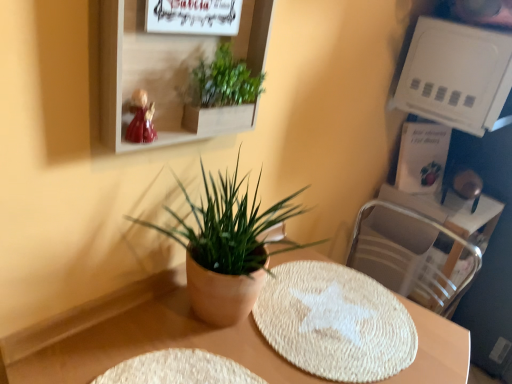
You are a GUI agent. You are given a task and a screenshot of the screen. Output one action in this format:
    pyautogui.click(x=<x>, y=<y>)
    Task: Click on the white woven mat at center
    The image size is (512, 384).
    Given the screenshot: What is the action you would take?
    pyautogui.click(x=335, y=322)

What do you see at coordinates (135, 337) in the screenshot?
I see `beige woven placemat at center` at bounding box center [135, 337].

This screenshot has height=384, width=512. What do you see at coordinates (228, 247) in the screenshot?
I see `green matte plant at center, which ranks as the first houseplant in bottom-to-top order` at bounding box center [228, 247].

Where is `white plastic shelf at upper right, which ranks as the 2th shelf in front-to-back order`? white plastic shelf at upper right, which ranks as the 2th shelf in front-to-back order is located at coordinates (456, 76).

Identify the location of white woven mat at center. The image size is (512, 384). (335, 322).

Is metallic silver swivel chair at right aimed at green matte plant at center, arranged as the 2th houseplant when viewed from the top?

Yes, metallic silver swivel chair at right is oriented towards green matte plant at center, arranged as the 2th houseplant when viewed from the top.

Is metallic silver swivel chair at right outside of green matte plant at center, arranged as the 2th houseplant when viewed from the top?

metallic silver swivel chair at right lies outside green matte plant at center, arranged as the 2th houseplant when viewed from the top,'s area.

Which object is positioned more to the left, metallic silver swivel chair at right or green matte plant at center, arranged as the 2th houseplant when viewed from the top?

From the viewer's perspective, green matte plant at center, arranged as the 2th houseplant when viewed from the top, appears more on the left side.

Considering the sizes of objects metallic silver swivel chair at right and white woven mat at center in the image provided, who is bigger, metallic silver swivel chair at right or white woven mat at center?

Bigger between the two is metallic silver swivel chair at right.

How many degrees apart are the facing directions of metallic silver swivel chair at right and white woven mat at center?

metallic silver swivel chair at right and white woven mat at center are facing 88.7 degrees away from each other.

Does point (362, 270) lie behind point (270, 306)?

Yes, point (362, 270) is farther from viewer.

From a real-world perspective, is green matte plant at center, which ranks as the first houseplant in bottom-to-top order, positioned under green leafy plant at upper center, which appears as the 2th houseplant when ordered from the bottom, based on gravity?

Yes, from a real-world perspective, green matte plant at center, which ranks as the first houseplant in bottom-to-top order, is under green leafy plant at upper center, which appears as the 2th houseplant when ordered from the bottom.

Consider the image. How many degrees apart are the facing directions of green matte plant at center, arranged as the 2th houseplant when viewed from the top, and green leafy plant at upper center, which appears as the 2th houseplant when ordered from the bottom?

The angle between the facing direction of green matte plant at center, arranged as the 2th houseplant when viewed from the top, and the facing direction of green leafy plant at upper center, which appears as the 2th houseplant when ordered from the bottom, is 2.8 degrees.

From the picture: Considering the sizes of green matte plant at center, arranged as the 2th houseplant when viewed from the top, and green leafy plant at upper center, which appears as the 2th houseplant when ordered from the bottom, in the image, is green matte plant at center, arranged as the 2th houseplant when viewed from the top, wider or thinner than green leafy plant at upper center, which appears as the 2th houseplant when ordered from the bottom,?

Clearly, green matte plant at center, arranged as the 2th houseplant when viewed from the top, has more width compared to green leafy plant at upper center, which appears as the 2th houseplant when ordered from the bottom.

Is green matte plant at center, arranged as the 2th houseplant when viewed from the top, oriented away from green leafy plant at upper center, which appears as the 1th houseplant when viewed from the top?

No, green leafy plant at upper center, which appears as the 1th houseplant when viewed from the top, is not at the back of green matte plant at center, arranged as the 2th houseplant when viewed from the top.

Is metallic silver swivel chair at right turned away from beige woven placemat at center?

No, metallic silver swivel chair at right is not facing the opposite direction of beige woven placemat at center.

Is point (429, 292) closer or farther from the camera than point (401, 375)?

Point (429, 292) is farther from the camera than point (401, 375).

Is metallic silver swivel chair at right next to beige woven placemat at center and touching it?

No, metallic silver swivel chair at right is not in contact with beige woven placemat at center.

Is metallic silver swivel chair at right taller than beige woven placemat at center?

No, metallic silver swivel chair at right is not taller than beige woven placemat at center.

Who is bigger, beige woven placemat at center or matte white shelf at upper center, which appears as the second shelf when viewed from the back?

beige woven placemat at center is bigger.

How much distance is there between beige woven placemat at center and matte white shelf at upper center, which is counted as the first shelf, starting from the front?

They are 17.12 inches apart.

How many degrees apart are the facing directions of beige woven placemat at center and matte white shelf at upper center, which is counted as the first shelf, starting from the front?

There is a 0.505-degree angle between the facing directions of beige woven placemat at center and matte white shelf at upper center, which is counted as the first shelf, starting from the front.

Is beige woven placemat at center thinner than matte white shelf at upper center, placed as the second shelf when sorted from right to left?

No, beige woven placemat at center is not thinner than matte white shelf at upper center, placed as the second shelf when sorted from right to left.

Is the position of green leafy plant at upper center, which appears as the 2th houseplant when ordered from the bottom, less distant than that of white plastic shelf at upper right, which is counted as the first shelf, starting from the back?

Yes, green leafy plant at upper center, which appears as the 2th houseplant when ordered from the bottom, is closer to the camera.

Is white plastic shelf at upper right, which ranks as the 2th shelf in front-to-back order, at the back of green leafy plant at upper center, which appears as the 1th houseplant when viewed from the top?

No, green leafy plant at upper center, which appears as the 1th houseplant when viewed from the top, is not facing the opposite direction of white plastic shelf at upper right, which ranks as the 2th shelf in front-to-back order.

Which is farther, (257, 98) or (414, 112)?

Positioned behind is point (414, 112).

From a real-world perspective, which is physically above, green leafy plant at upper center, which appears as the 1th houseplant when viewed from the top, or white plastic shelf at upper right, which ranks as the 2th shelf in front-to-back order?

white plastic shelf at upper right, which ranks as the 2th shelf in front-to-back order, from a real-world perspective.

From a real-world perspective, which is physically above, white plastic shelf at upper right, which ranks as the 1th shelf in right-to-left order, or beige woven placemat at center?

In real-world perspective, white plastic shelf at upper right, which ranks as the 1th shelf in right-to-left order, is above.

Considering the sizes of objects white plastic shelf at upper right, which is counted as the first shelf, starting from the back, and beige woven placemat at center in the image provided, who is smaller, white plastic shelf at upper right, which is counted as the first shelf, starting from the back, or beige woven placemat at center?

Smaller between the two is white plastic shelf at upper right, which is counted as the first shelf, starting from the back.

Considering the relative sizes of white plastic shelf at upper right, which ranks as the 1th shelf in right-to-left order, and beige woven placemat at center in the image provided, is white plastic shelf at upper right, which ranks as the 1th shelf in right-to-left order, shorter than beige woven placemat at center?

Yes, white plastic shelf at upper right, which ranks as the 1th shelf in right-to-left order, is shorter than beige woven placemat at center.

The width and height of the screenshot is (512, 384). What are the coordinates of `the 1st houseplant to the left of the metallic silver swivel chair at right, counting from the anchor's position` in the screenshot? It's located at (228, 247).

You are a GUI agent. You are given a task and a screenshot of the screen. Output one action in this format:
    pyautogui.click(x=<x>, y=<y>)
    Task: Click on the mat that appears below the metallic silver swivel chair at right (from the image's perspective)
    
    Given the screenshot: What is the action you would take?
    pyautogui.click(x=335, y=322)

Which object lies further to the anchor point metallic silver swivel chair at right, green leafy plant at upper center, which appears as the 2th houseplant when ordered from the bottom, or matte white shelf at upper center, placed as the second shelf when sorted from right to left?

matte white shelf at upper center, placed as the second shelf when sorted from right to left, is further to metallic silver swivel chair at right.

In the scene shown: From the image, which object appears to be farther from white plastic shelf at upper right, which is counted as the second shelf, starting from the left, beige woven placemat at center or green leafy plant at upper center, which appears as the 1th houseplant when viewed from the top?

beige woven placemat at center is positioned further to the anchor white plastic shelf at upper right, which is counted as the second shelf, starting from the left.

Which object lies further to the anchor point white woven mat at center, metallic silver swivel chair at right or white plastic shelf at upper right, which ranks as the 2th shelf in front-to-back order?

The object further to white woven mat at center is white plastic shelf at upper right, which ranks as the 2th shelf in front-to-back order.

When comparing their distances from white woven mat at center, does beige woven placemat at center or green matte plant at center, arranged as the 2th houseplant when viewed from the top, seem further?

green matte plant at center, arranged as the 2th houseplant when viewed from the top.

Which object lies nearer to the anchor point green leafy plant at upper center, which appears as the 1th houseplant when viewed from the top, green matte plant at center, which ranks as the first houseplant in bottom-to-top order, or matte white shelf at upper center, which is counted as the first shelf, starting from the front?

matte white shelf at upper center, which is counted as the first shelf, starting from the front, is closer to green leafy plant at upper center, which appears as the 1th houseplant when viewed from the top.

Based on their spatial positions, is green matte plant at center, which ranks as the first houseplant in bottom-to-top order, or beige woven placemat at center closer to matte white shelf at upper center, placed as the second shelf when sorted from right to left?

green matte plant at center, which ranks as the first houseplant in bottom-to-top order.

Estimate the real-world distances between objects in this image. Which object is closer to green matte plant at center, arranged as the 2th houseplant when viewed from the top, white plastic shelf at upper right, which is counted as the first shelf, starting from the back, or metallic silver swivel chair at right?

metallic silver swivel chair at right.

Considering their positions, is metallic silver swivel chair at right positioned further to green matte plant at center, arranged as the 2th houseplant when viewed from the top, than green leafy plant at upper center, which appears as the 1th houseplant when viewed from the top?

metallic silver swivel chair at right lies further to green matte plant at center, arranged as the 2th houseplant when viewed from the top, than the other object.

At what (x,y) coordinates should I click in order to perform the action: click on houseplant between green leafy plant at upper center, which appears as the 1th houseplant when viewed from the top, and beige woven placemat at center, in the vertical direction. Please return your answer as a coordinate pair (x, y). Looking at the image, I should click on (228, 247).

This screenshot has height=384, width=512. Identify the location of houseplant between green leafy plant at upper center, which appears as the 2th houseplant when ordered from the bottom, and white plastic shelf at upper right, which ranks as the 2th shelf in front-to-back order. (228, 247).

This screenshot has height=384, width=512. In order to click on swivel chair situated between green matte plant at center, which ranks as the first houseplant in bottom-to-top order, and white plastic shelf at upper right, which ranks as the 2th shelf in front-to-back order, from left to right in this screenshot , I will do `click(409, 255)`.

The width and height of the screenshot is (512, 384). Identify the location of mat located between green matte plant at center, which ranks as the first houseplant in bottom-to-top order, and white plastic shelf at upper right, which is counted as the second shelf, starting from the left, in the left-right direction. (335, 322).